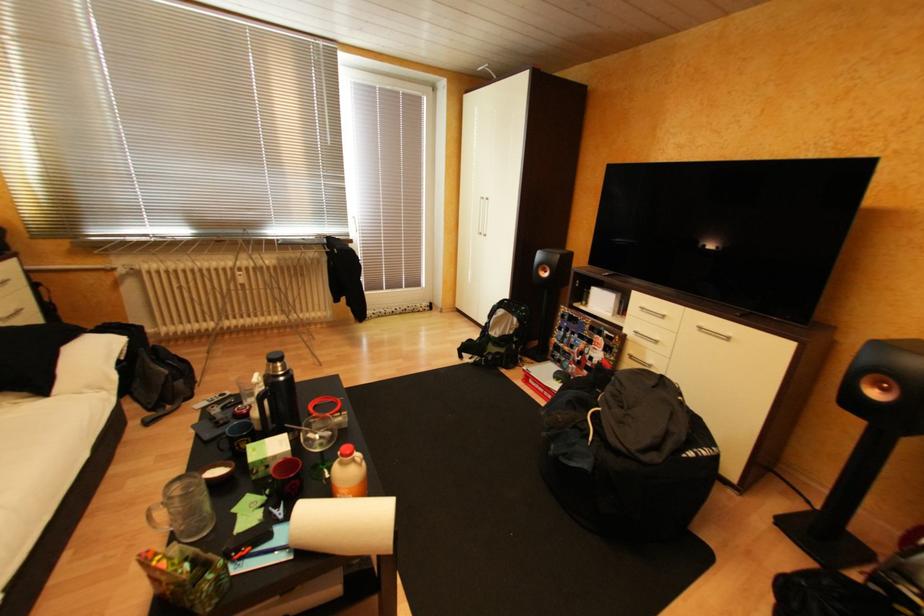
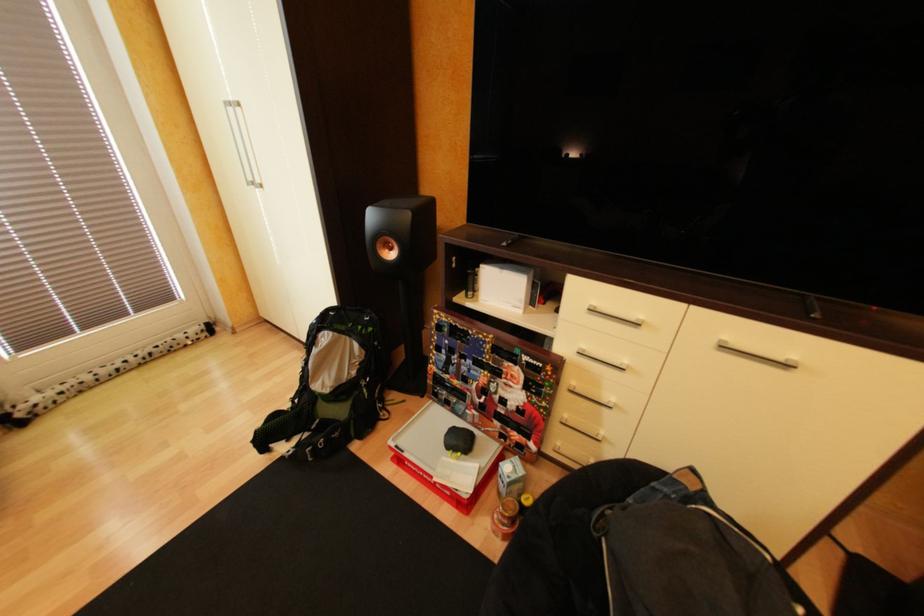
Question: The images are taken continuously from a first-person perspective. In which direction are you moving?

Choices:
 (A) Left
 (B) Right
 (C) Forward
 (D) Backward

Answer: (C)